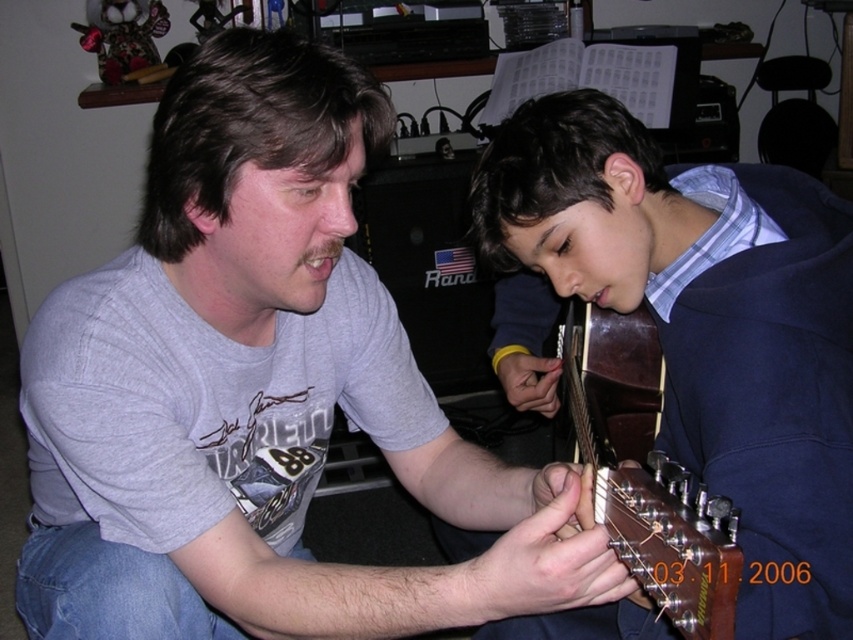
You are a photographer setting up for a family portrait in the scene. You need to ensure both the dark blue sweater at center and the brown glossy guitar at lower center are fully visible in the frame. Which object requires a wider shot to capture its full width?

The dark blue sweater at center requires a wider shot because its width surpasses that of the brown glossy guitar at lower center.

You are holding a camera and want to capture a closeup of the point at coordinates (115, 358). The camera has a focal length of 50mm. If the point is 30.72 inches away from the camera, what adjustment should you make to the focal length to ensure the point fills the frame without moving the camera?

To capture a closeup of the point at coordinates (115, 358), which is 30.72 inches from the camera, you should increase the focal length beyond 50mm. A longer focal length will magnify the subject, allowing the point to fill the frame without moving the camera.